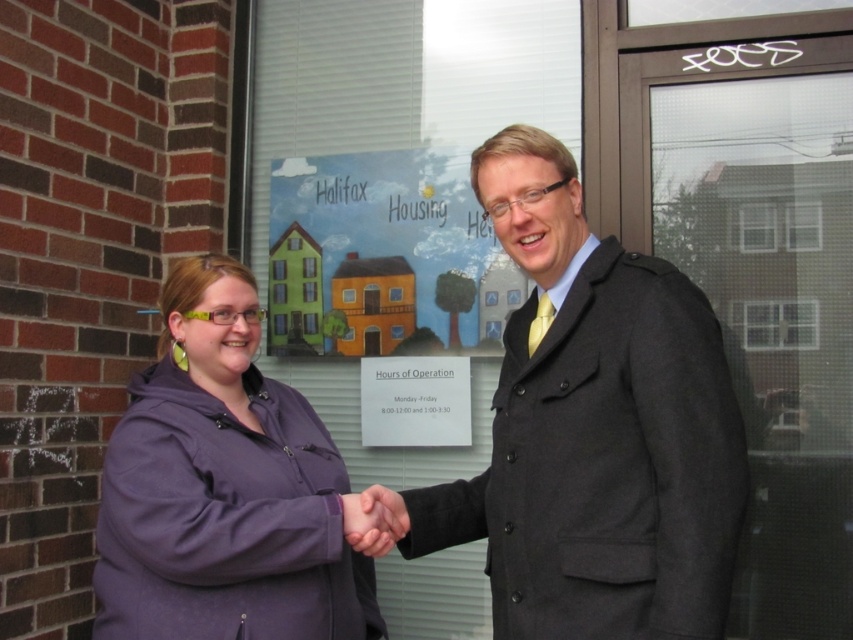
Question: Which point is farther to the camera?

Choices:
 (A) dark gray wool coat at center
 (B) purple fleece jacket at center

Answer: (B)

Question: Can you confirm if dark gray wool coat at center is positioned above purple fleece jacket at center?

Choices:
 (A) no
 (B) yes

Answer: (B)

Question: Which point is closer to the camera?

Choices:
 (A) purple fleece jacket at center
 (B) dark gray wool coat at center

Answer: (B)

Question: Is the position of dark gray wool coat at center less distant than that of purple fleece jacket at center?

Choices:
 (A) no
 (B) yes

Answer: (B)

Question: Which point appears closest to the camera in this image?

Choices:
 (A) (532, 476)
 (B) (120, 600)

Answer: (A)

Question: Is dark gray wool coat at center wider than purple fleece jacket at center?

Choices:
 (A) no
 (B) yes

Answer: (B)